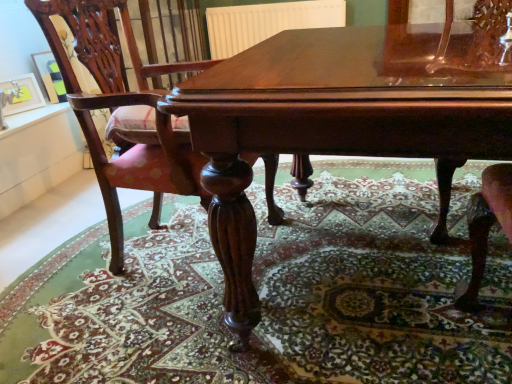
Question: Is matte black picture frame at upper left, which appears as the first picture frame when viewed from the back, positioned in front of polished wood chair at center?

Choices:
 (A) no
 (B) yes

Answer: (A)

Question: Is matte black picture frame at upper left, which is the 2th picture frame from front to back, wider than polished wood chair at center?

Choices:
 (A) yes
 (B) no

Answer: (B)

Question: Is matte black picture frame at upper left, which is the 2th picture frame from front to back, shorter than polished wood chair at center?

Choices:
 (A) no
 (B) yes

Answer: (B)

Question: Is matte black picture frame at upper left, which is the 2th picture frame from front to back, surrounding polished wood chair at center?

Choices:
 (A) yes
 (B) no

Answer: (B)

Question: Does matte black picture frame at upper left, which is the 2th picture frame from front to back, have a larger size compared to polished wood chair at center?

Choices:
 (A) no
 (B) yes

Answer: (A)

Question: Considering their positions, is brushed metal picture frame at upper left, arranged as the second picture frame when viewed from the back, located in front of or behind polished wood table at center?

Choices:
 (A) behind
 (B) front

Answer: (A)

Question: Is brushed metal picture frame at upper left, which is counted as the 1th picture frame, starting from the front, to the left or to the right of polished wood table at center in the image?

Choices:
 (A) left
 (B) right

Answer: (A)

Question: Based on their sizes in the image, would you say brushed metal picture frame at upper left, which is counted as the 1th picture frame, starting from the front, is bigger or smaller than polished wood table at center?

Choices:
 (A) small
 (B) big

Answer: (A)

Question: Does point (11, 96) appear closer or farther from the camera than point (327, 64)?

Choices:
 (A) closer
 (B) farther

Answer: (B)

Question: Is point (297, 110) closer or farther from the camera than point (38, 18)?

Choices:
 (A) closer
 (B) farther

Answer: (A)

Question: Looking at the image, does polished wood table at center seem bigger or smaller compared to polished wood chair at center?

Choices:
 (A) big
 (B) small

Answer: (A)

Question: From the image's perspective, is polished wood table at center positioned above or below polished wood chair at center?

Choices:
 (A) below
 (B) above

Answer: (A)

Question: Looking at their shapes, would you say polished wood table at center is wider or thinner than polished wood chair at center?

Choices:
 (A) wide
 (B) thin

Answer: (A)

Question: In the image, is white matte radiator at upper center on the left side or the right side of matte black picture frame at upper left, which is the 2th picture frame from front to back?

Choices:
 (A) right
 (B) left

Answer: (A)

Question: Does point (256, 21) appear closer or farther from the camera than point (34, 54)?

Choices:
 (A) farther
 (B) closer

Answer: (A)